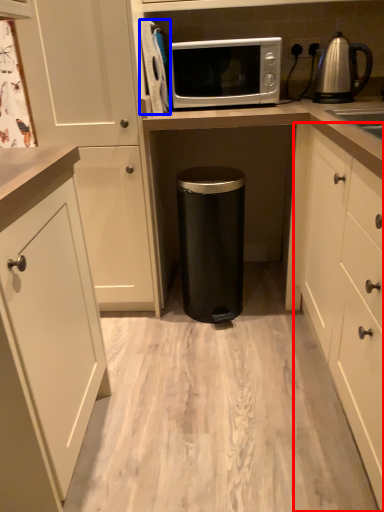
Question: Which object appears closest to the camera in this image, cabinetry (highlighted by a red box) or appliance (highlighted by a blue box)?

Choices:
 (A) cabinetry
 (B) appliance

Answer: (A)